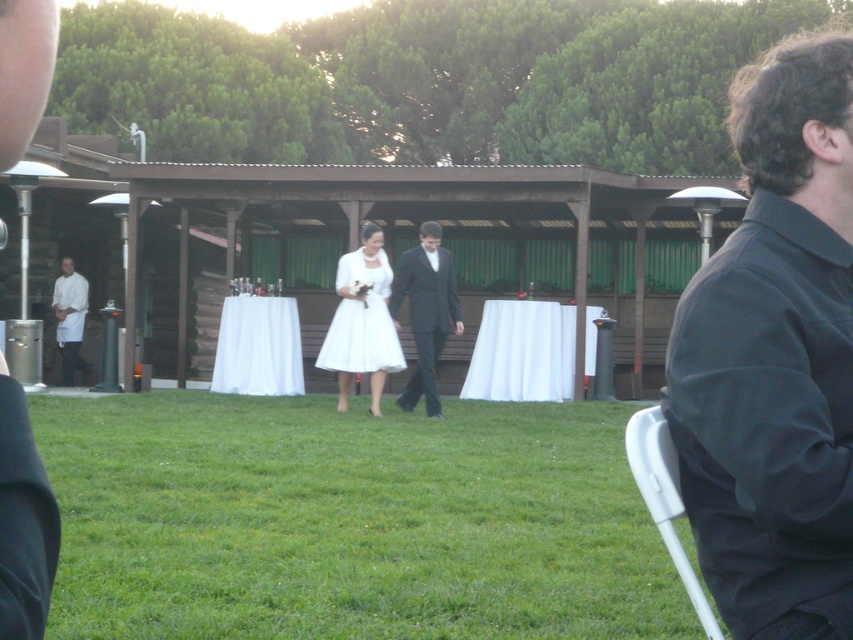
Question: Which object appears farthest from the camera in this image?

Choices:
 (A) white linen chef at left
 (B) black satin suit at center
 (C) white satin dress at center

Answer: (A)

Question: Which point is closer to the camera taking this photo?

Choices:
 (A) (x=538, y=420)
 (B) (x=80, y=356)
 (C) (x=773, y=381)

Answer: (C)

Question: Among these objects, which one is farthest from the camera?

Choices:
 (A) white satin dress at center
 (B) black satin suit at center
 (C) white fabric tablecloth at center

Answer: (A)

Question: Does white fabric tablecloth at center have a greater width compared to white satin dress at center?

Choices:
 (A) no
 (B) yes

Answer: (A)

Question: Considering the relative positions of green grass at center and dark gray fabric shirt at right in the image provided, where is green grass at center located with respect to dark gray fabric shirt at right?

Choices:
 (A) below
 (B) above

Answer: (A)

Question: Does green grass at center come behind dark gray fabric shirt at right?

Choices:
 (A) no
 (B) yes

Answer: (B)